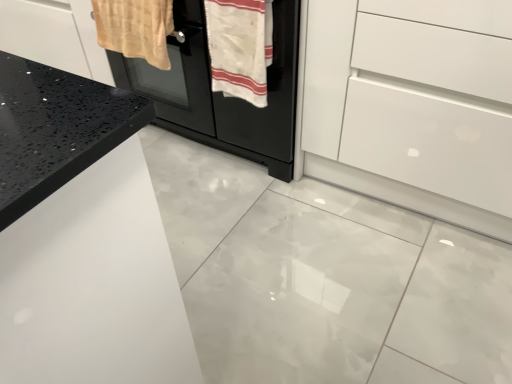
Question: Considering the relative sizes of beige woven towel at upper left, which is the 1th bath towel from left to right, and white glossy drawer at center in the image provided, is beige woven towel at upper left, which is the 1th bath towel from left to right, shorter than white glossy drawer at center?

Choices:
 (A) yes
 (B) no

Answer: (A)

Question: Does beige woven towel at upper left, which is the 1th bath towel from left to right, appear on the right side of white glossy drawer at center?

Choices:
 (A) yes
 (B) no

Answer: (B)

Question: From a real-world perspective, is beige woven towel at upper left, positioned as the second bath towel in right-to-left order, on white glossy drawer at center?

Choices:
 (A) yes
 (B) no

Answer: (A)

Question: Is beige woven towel at upper left, which is the 1th bath towel from left to right, smaller than white glossy drawer at center?

Choices:
 (A) yes
 (B) no

Answer: (A)

Question: From the image's perspective, does beige woven towel at upper left, positioned as the second bath towel in right-to-left order, appear lower than white glossy drawer at center?

Choices:
 (A) no
 (B) yes

Answer: (A)

Question: From a real-world perspective, is beige woven towel at upper left, positioned as the second bath towel in right-to-left order, above or below black matte oven at center?

Choices:
 (A) below
 (B) above

Answer: (B)

Question: Considering the positions of beige woven towel at upper left, positioned as the second bath towel in right-to-left order, and black matte oven at center in the image, is beige woven towel at upper left, positioned as the second bath towel in right-to-left order, wider or thinner than black matte oven at center?

Choices:
 (A) wide
 (B) thin

Answer: (B)

Question: Considering the positions of beige woven towel at upper left, which is the 1th bath towel from left to right, and black matte oven at center in the image, is beige woven towel at upper left, which is the 1th bath towel from left to right, bigger or smaller than black matte oven at center?

Choices:
 (A) small
 (B) big

Answer: (A)

Question: From the image's perspective, is beige woven towel at upper left, which is the 1th bath towel from left to right, located above or below black matte oven at center?

Choices:
 (A) above
 (B) below

Answer: (B)

Question: In terms of height, does white glossy drawer at center look taller or shorter compared to beige woven towel at upper left, which is the 1th bath towel from left to right?

Choices:
 (A) tall
 (B) short

Answer: (A)

Question: Is white glossy drawer at center situated inside beige woven towel at upper left, positioned as the second bath towel in right-to-left order, or outside?

Choices:
 (A) outside
 (B) inside

Answer: (A)

Question: Considering the positions of white glossy drawer at center and beige woven towel at upper left, positioned as the second bath towel in right-to-left order, in the image, is white glossy drawer at center bigger or smaller than beige woven towel at upper left, positioned as the second bath towel in right-to-left order,?

Choices:
 (A) small
 (B) big

Answer: (B)

Question: From a real-world perspective, is white glossy drawer at center physically located above or below beige woven towel at upper left, which is the 1th bath towel from left to right?

Choices:
 (A) below
 (B) above

Answer: (A)

Question: From a real-world perspective, is white cotton towel at center, the first bath towel in the right-to-left sequence, above or below beige woven towel at upper left, positioned as the second bath towel in right-to-left order?

Choices:
 (A) above
 (B) below

Answer: (A)

Question: In terms of width, does white cotton towel at center, marked as the 2th bath towel in a left-to-right arrangement, look wider or thinner when compared to beige woven towel at upper left, positioned as the second bath towel in right-to-left order?

Choices:
 (A) wide
 (B) thin

Answer: (B)